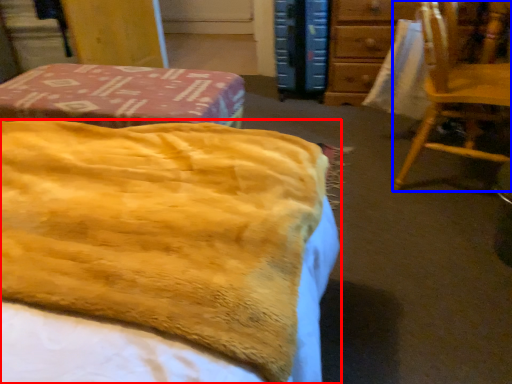
Question: Among these objects, which one is farthest to the camera, bed (highlighted by a red box) or chair (highlighted by a blue box)?

Choices:
 (A) bed
 (B) chair

Answer: (B)